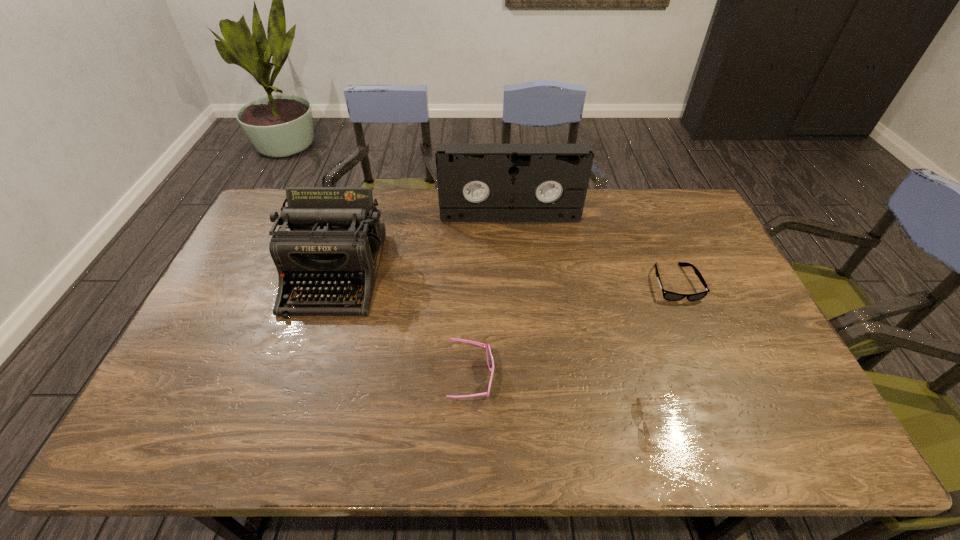
This screenshot has width=960, height=540. What are the coordinates of `vacant space at the near edge` in the screenshot? It's located at (585, 430).

In the image, there is a desktop. Where is `free space at the left edge`? The height and width of the screenshot is (540, 960). free space at the left edge is located at coordinates (226, 356).

The width and height of the screenshot is (960, 540). I want to click on vacant region at the right edge, so click(739, 392).

The height and width of the screenshot is (540, 960). What are the coordinates of `free point at the near left corner` in the screenshot? It's located at (200, 423).

I want to click on vacant space at the near right corner of the desktop, so click(784, 454).

The image size is (960, 540). In order to click on free space between the leftmost object and the farthest sunglasses in this screenshot , I will do `click(505, 278)`.

Identify the location of empty location between the second sunglasses from right to left and the typewriter. The width and height of the screenshot is (960, 540). (497, 348).

You are a GUI agent. You are given a task and a screenshot of the screen. Output one action in this format:
    pyautogui.click(x=<x>, y=<y>)
    Task: Click on the free spot between the tallest sunglasses and the fourth shortest object
    This screenshot has height=540, width=960.
    Given the screenshot: What is the action you would take?
    click(403, 326)

This screenshot has height=540, width=960. I want to click on vacant area that lies between the leftmost object and the videotape, so click(x=422, y=245).

Where is `free space between the farthest sunglasses and the farthest object`? The image size is (960, 540). free space between the farthest sunglasses and the farthest object is located at coordinates (592, 249).